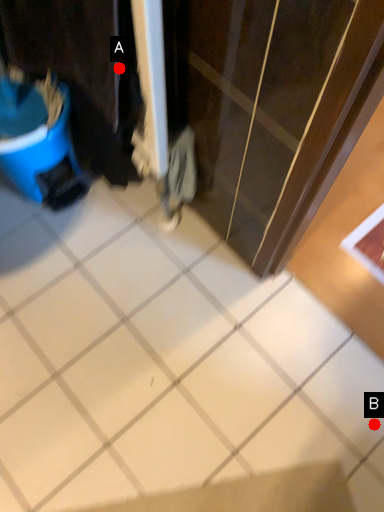
Question: Two points are circled on the image, labeled by A and B beside each circle. Which point is closer to the camera?

Choices:
 (A) A is closer
 (B) B is closer

Answer: (A)